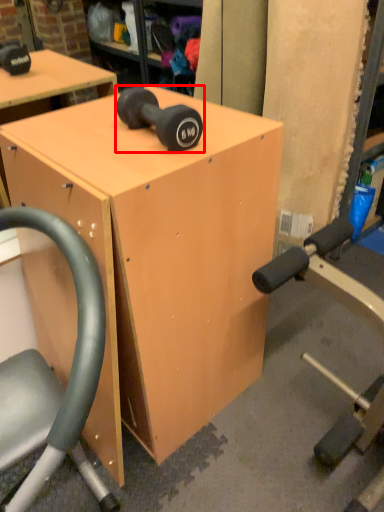
Question: From the image's perspective, what is the correct spatial relationship of dumbbell (annotated by the red box) in relation to table?

Choices:
 (A) below
 (B) above

Answer: (B)